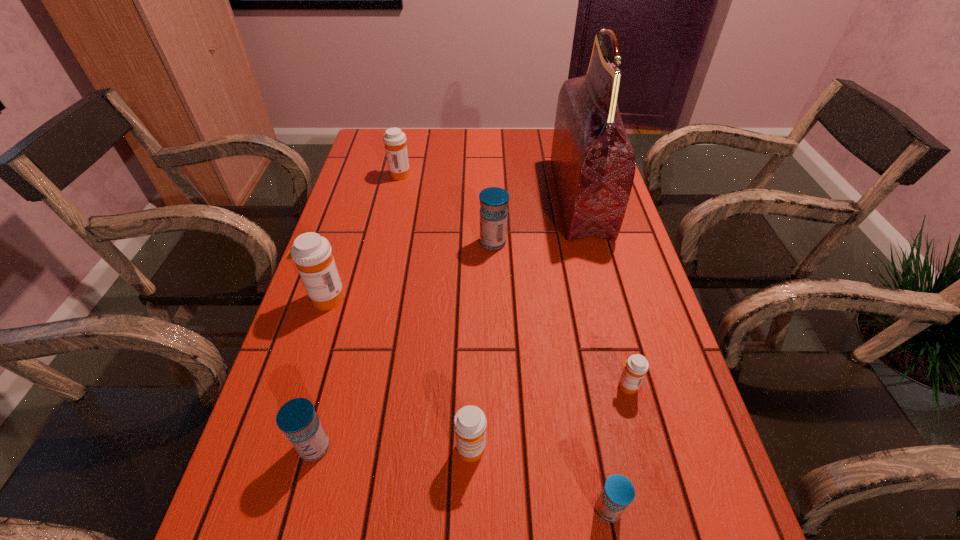
Where is `blank area located 0.120m on the front of the farthest blue medicine`? The width and height of the screenshot is (960, 540). blank area located 0.120m on the front of the farthest blue medicine is located at coordinates (494, 285).

Locate an element on the screen. This screenshot has width=960, height=540. vacant space located 0.050m on the right of the nearest orange medicine is located at coordinates (515, 450).

The height and width of the screenshot is (540, 960). Find the location of `vacant space located 0.240m on the back of the leftmost blue medicine`. vacant space located 0.240m on the back of the leftmost blue medicine is located at coordinates (347, 327).

I want to click on vacant region located on the back of the rightmost orange medicine, so click(612, 333).

Image resolution: width=960 pixels, height=540 pixels. Identify the location of vacant space located on the back of the smallest blue medicine. (594, 437).

Where is `object positioned at the far edge`? This screenshot has height=540, width=960. object positioned at the far edge is located at coordinates (593, 161).

Find the location of `handbag at the right edge`. handbag at the right edge is located at coordinates (593, 161).

This screenshot has width=960, height=540. Identify the location of medicine that is at the right edge. (636, 366).

Where is `object located at the far right corner`? object located at the far right corner is located at coordinates (593, 161).

You are a GUI agent. You are given a task and a screenshot of the screen. Output one action in this format:
    pyautogui.click(x=<x>, y=<y>)
    Task: Click on the vacant space at the far edge
    Image resolution: width=960 pixels, height=540 pixels.
    Given the screenshot: What is the action you would take?
    pyautogui.click(x=448, y=151)